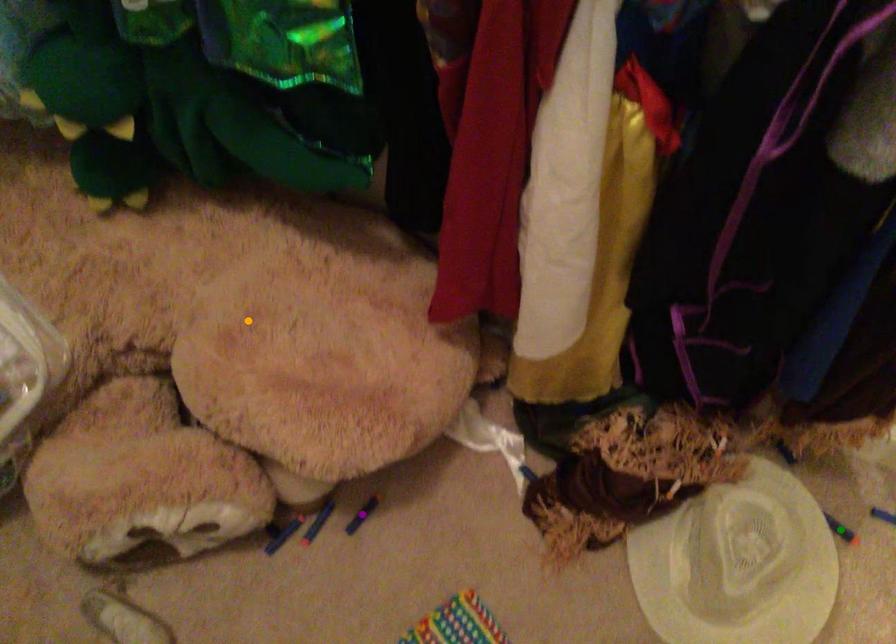
Order these from nearest to farthest:
green point
orange point
purple point

1. orange point
2. green point
3. purple point